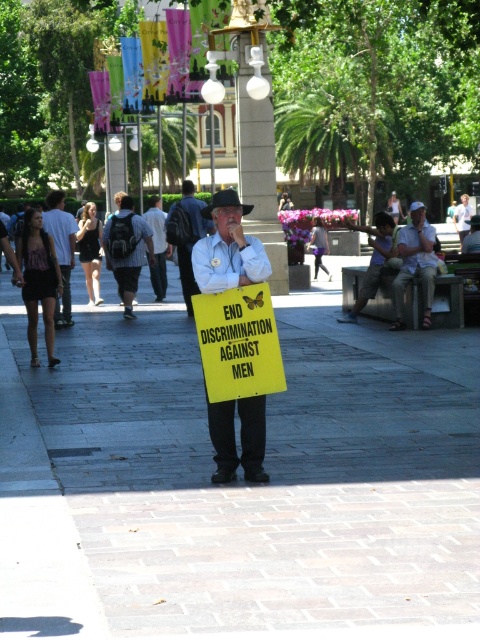
Question: Considering the relative positions of white cloth shirt at center and light brown wooden bench at center in the image provided, where is white cloth shirt at center located with respect to light brown wooden bench at center?

Choices:
 (A) left
 (B) right

Answer: (A)

Question: Which object appears farthest from the camera in this image?

Choices:
 (A) white cotton shirt at center
 (B) dark blue jeans at center

Answer: (B)

Question: Does brick pavement at center lie behind light brown wooden bench at center?

Choices:
 (A) no
 (B) yes

Answer: (A)

Question: Among these objects, which one is nearest to the camera?

Choices:
 (A) dark gray backpack at left
 (B) white paper sign at center
 (C) brick pavement at center

Answer: (C)

Question: Which of the following is the farthest from the observer?

Choices:
 (A) (120, 260)
 (B) (180, 221)

Answer: (B)

Question: Is white cotton shirt at center thinner than dark blue jeans at center?

Choices:
 (A) no
 (B) yes

Answer: (A)